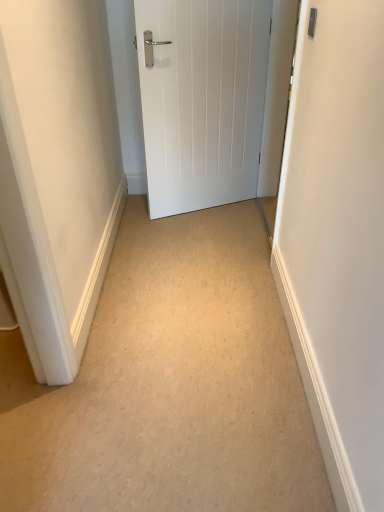
Find the location of a particular element. Image resolution: width=384 pixels, height=512 pixels. blank space situated above beige carpet at center (from a real-world perspective) is located at coordinates (169, 298).